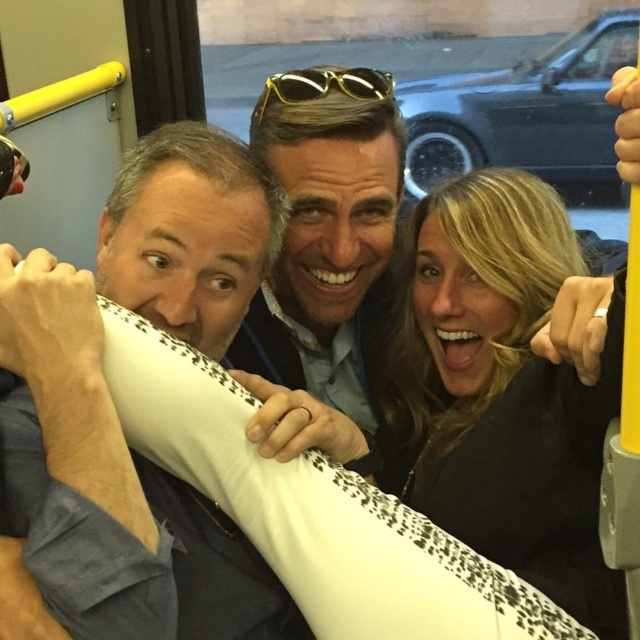
You are a delivery person who needs to place both the black matte surfboard at center and the gold metallic sunglasses at center into a rectangular box. The box can only fit items with a combined width of up to 50 cm. If the surfboard is 35 cm wide, will both items fit together?

The black matte surfboard at center is wider than the gold metallic sunglasses at center. Since the surfboard is 35 cm wide, the sunglasses must be narrower than 35 cm. Adding both widths would exceed 50 cm, so they cannot fit together in the box.

You are standing on the bus and want to greet both the matte blue shirt at left and the gold metallic sunglasses at center. Which one should you approach first based on their positions?

You should approach the matte blue shirt at left first because it is closer to you than the gold metallic sunglasses at center.

You are on a crowded bus and need to get past the matte blue shirt at left and the black matte surfboard at center. Which object should you move first to create space?

The matte blue shirt at left is in front of the black matte surfboard at center, so you should move the matte blue shirt at left first to create space.